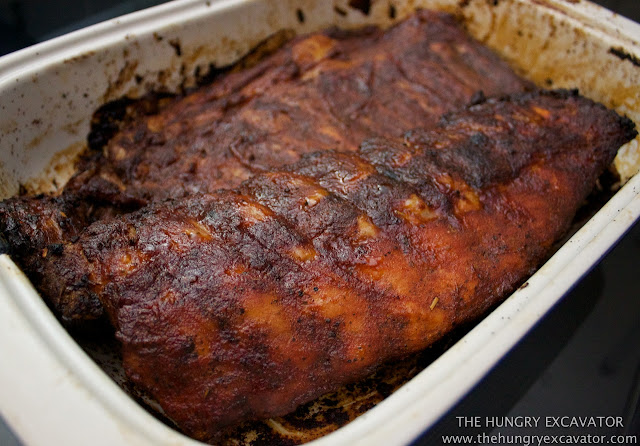
Where is `bottom of dish`? bottom of dish is located at coordinates (329, 414).